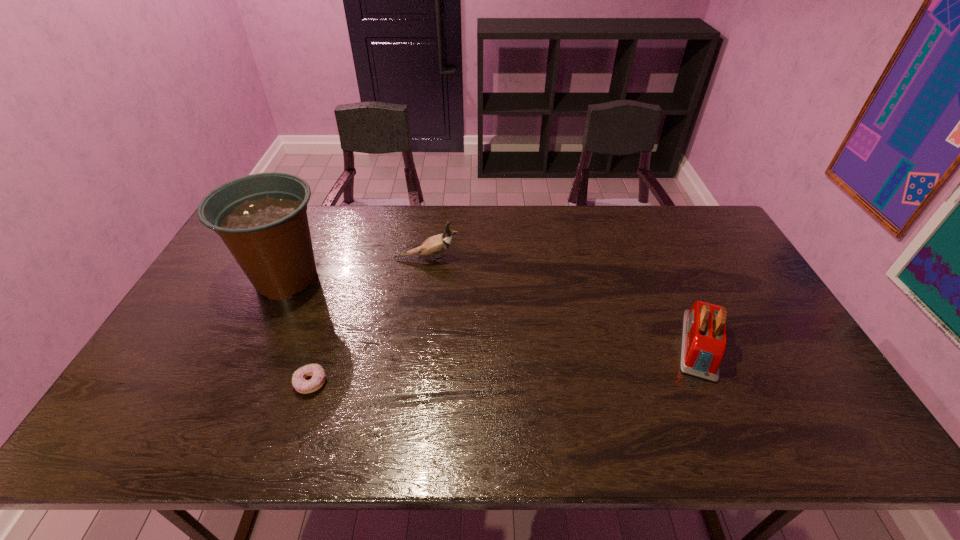
Find the location of a particular element. vacant space at the near edge of the desktop is located at coordinates (237, 415).

The height and width of the screenshot is (540, 960). Find the location of `vacant area at the left edge`. vacant area at the left edge is located at coordinates (210, 321).

At what (x,y) coordinates should I click in order to perform the action: click on free space at the right edge. Please return your answer as a coordinate pair (x, y). This screenshot has height=540, width=960. Looking at the image, I should click on (797, 350).

In order to click on vacant space at the far right corner of the desktop in this screenshot , I will do `click(678, 214)`.

Identify the location of free space at the near right corner. This screenshot has width=960, height=540. (812, 415).

This screenshot has width=960, height=540. I want to click on empty space between the doughnut and the third object from left to right, so click(369, 321).

Identify the location of vacant area between the doughnut and the tallest object. This screenshot has height=540, width=960. (299, 331).

At what (x,y) coordinates should I click in order to perform the action: click on blank region between the toaster and the doughnut. Please return your answer as a coordinate pair (x, y). Image resolution: width=960 pixels, height=540 pixels. Looking at the image, I should click on (505, 364).

Locate an element on the screen. free space between the bird and the tallest object is located at coordinates (357, 269).

Where is `unoccupied area between the rightmost object and the second object from right to left`? This screenshot has width=960, height=540. unoccupied area between the rightmost object and the second object from right to left is located at coordinates (564, 302).